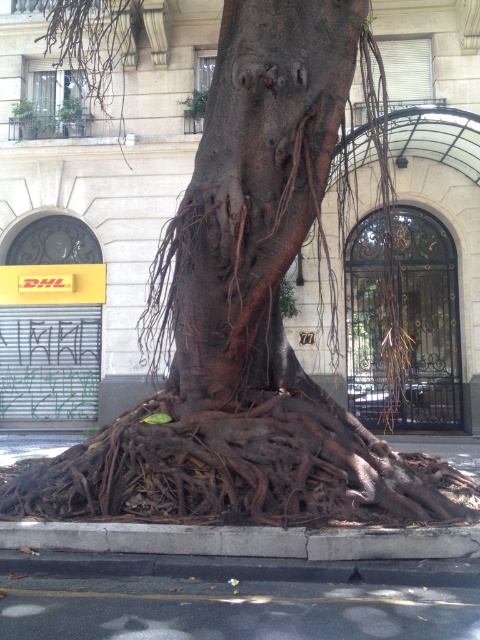
Question: Is brown rough bark at center positioned before brown rough roots at lower center?

Choices:
 (A) no
 (B) yes

Answer: (A)

Question: Considering the real-world distances, which object is closest to the brown rough bark at center?

Choices:
 (A) brown rough roots at lower center
 (B) black asphalt at lower center

Answer: (A)

Question: Which of the following is the farthest from the observer?

Choices:
 (A) (11, 497)
 (B) (408, 612)

Answer: (A)

Question: In this image, where is black asphalt at lower center located relative to gray concrete curb at lower center?

Choices:
 (A) left
 (B) right

Answer: (A)

Question: Which of the following is the farthest from the observer?

Choices:
 (A) gray concrete curb at lower center
 (B) black asphalt at lower center
 (C) brown rough bark at center
 (D) brown rough roots at lower center

Answer: (C)

Question: Is brown rough roots at lower center wider than black asphalt at lower center?

Choices:
 (A) yes
 (B) no

Answer: (A)